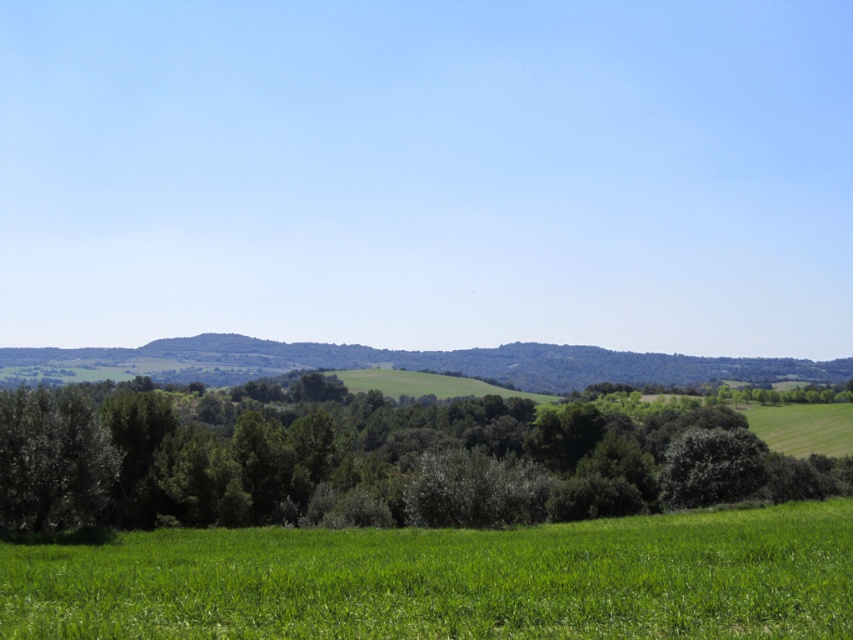
Between point (123, 445) and point (196, 609), which one is positioned in front?

Point (196, 609)

Does green leafy trees at center have a greater width compared to green grassy field at lower left?

Yes, green leafy trees at center is wider than green grassy field at lower left.

The width and height of the screenshot is (853, 640). Describe the element at coordinates (376, 460) in the screenshot. I see `green leafy trees at center` at that location.

You are a GUI agent. You are given a task and a screenshot of the screen. Output one action in this format:
    pyautogui.click(x=<x>, y=<y>)
    Task: Click on the green leafy trees at center
    This screenshot has width=853, height=640.
    Given the screenshot: What is the action you would take?
    pyautogui.click(x=376, y=460)